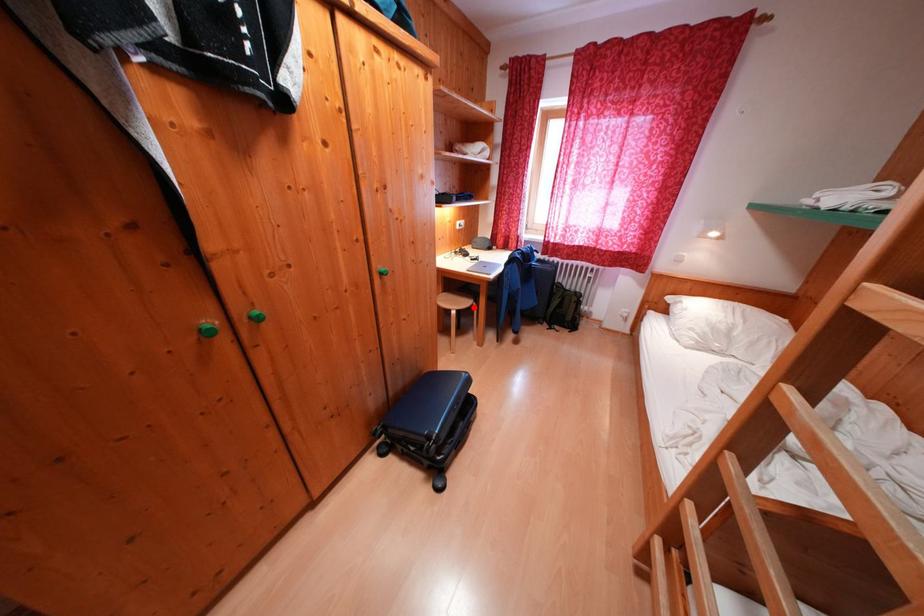
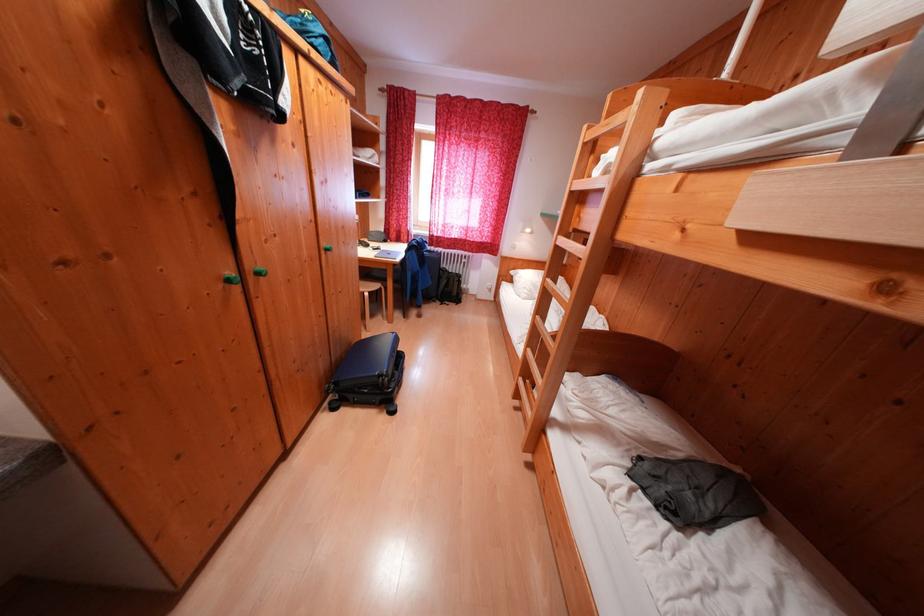
Question: A red point is marked in image1. In image2, is the corresponding 3D point closer to the camera or farther? Reply with the corresponding letter.

Choices:
 (A) The corresponding 3D point is closer.
 (B) The corresponding 3D point is farther.

Answer: (A)